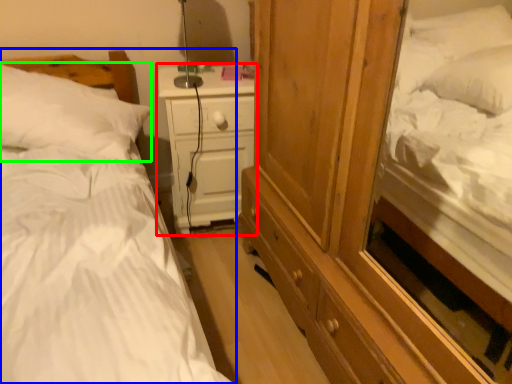
Question: Considering the real-world distances, which object is closest to nightstand (highlighted by a red box)? bed (highlighted by a blue box) or pillow (highlighted by a green box).

Choices:
 (A) bed
 (B) pillow

Answer: (B)